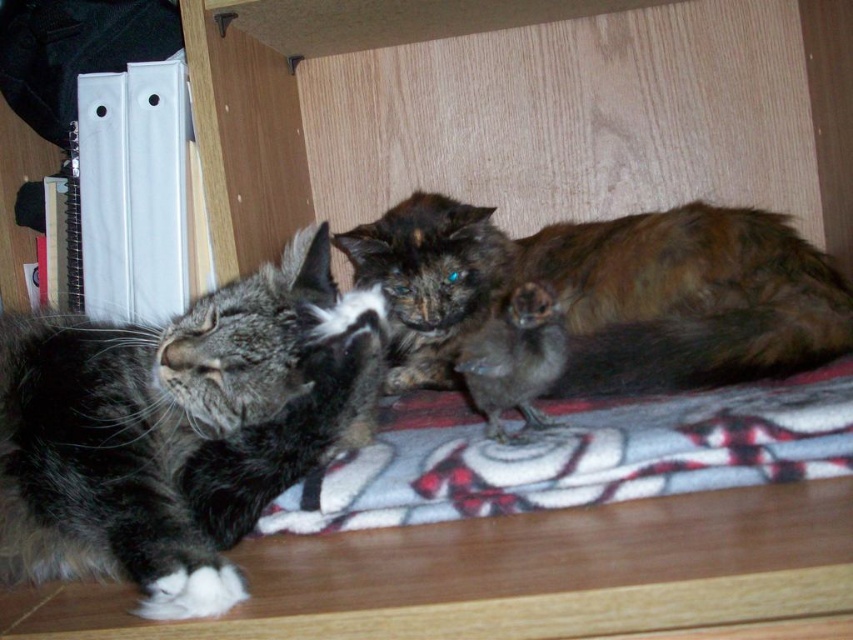
You are an observer looking at the wooden shelf with a patterned blanket. Where is the fluffy brown cat at center located in terms of its 2D coordinates?

The fluffy brown cat at center is located at the 2D coordinates point (611, 292).

You are a cat owner observing the gray fluffy cat at left and the fluffy brown cat at center on the wooden shelf. Which cat is taller?

The gray fluffy cat at left is taller than the fluffy brown cat at center.

You are standing in front of the wooden shelf and want to place a small toy between the two points, point 1 at (447, 333) and point 2 at (415, 417). Which point should you place the toy closer to so that it is in front of both points?

To place the toy in front of both points, you should position it closer to point 2 at (415, 417) because point 1 is behind point 2.